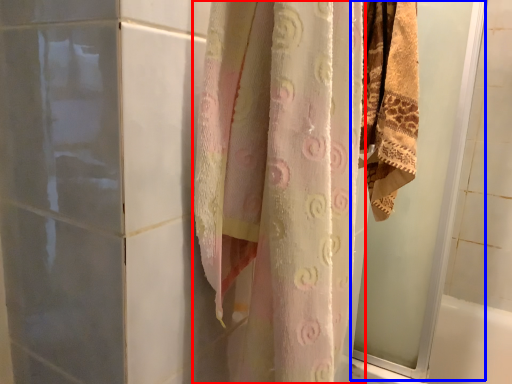
Question: Among these objects, which one is nearest to the camera, curtain (highlighted by a red box) or screen door (highlighted by a blue box)?

Choices:
 (A) curtain
 (B) screen door

Answer: (A)